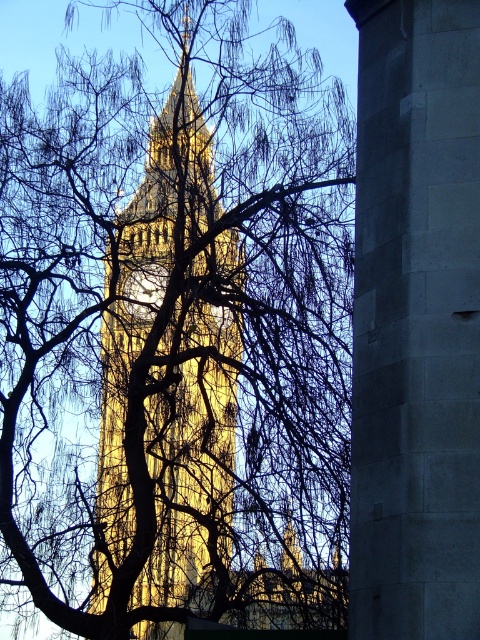
You are standing in the park and see the historic clock tower with two points marked on the image. The first point is at coordinate point(374, 76) and the second at point(199, 144). Which point is closer to you?

Point(374, 76) is in front of point(199, 144), so it is closer to you.

You are a drone operator tasked with flying a drone between the gray stone pillar at center and the golden stone tower at center. The drone has a maximum flight distance of 100 feet. Can the drone safely fly between them without exceeding its range?

The gray stone pillar at center and golden stone tower at center are 80.44 feet apart from each other, which is within the drone operator maximum flight distance of 100 feet. Yes, the drone can safely fly between them without exceeding its range.

You are an architect analyzing the image of the clock tower. You need to determine the spatial relationship between the bare branches at center and the gray stone pillar at center. Which object is positioned higher in the image?

The bare branches at center is located above the gray stone pillar at center, so the bare branches at center is positioned higher.